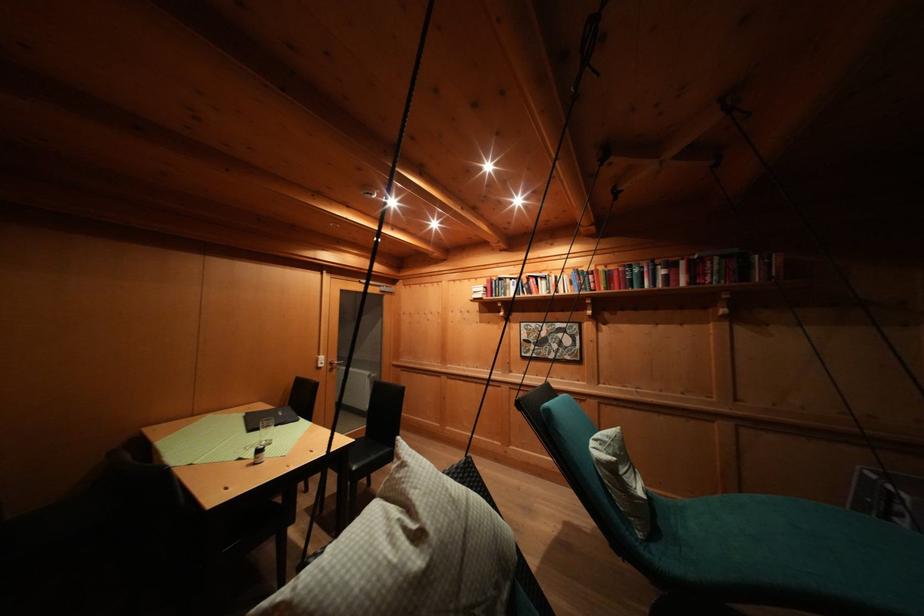
Identify the location of door handle. This screenshot has height=616, width=924. (334, 363).